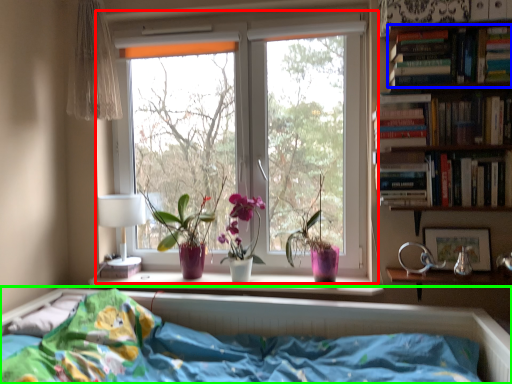
Question: Considering the real-world distances, which object is farthest from window (highlighted by a red box)? book (highlighted by a blue box) or bed (highlighted by a green box)?

Choices:
 (A) book
 (B) bed

Answer: (B)